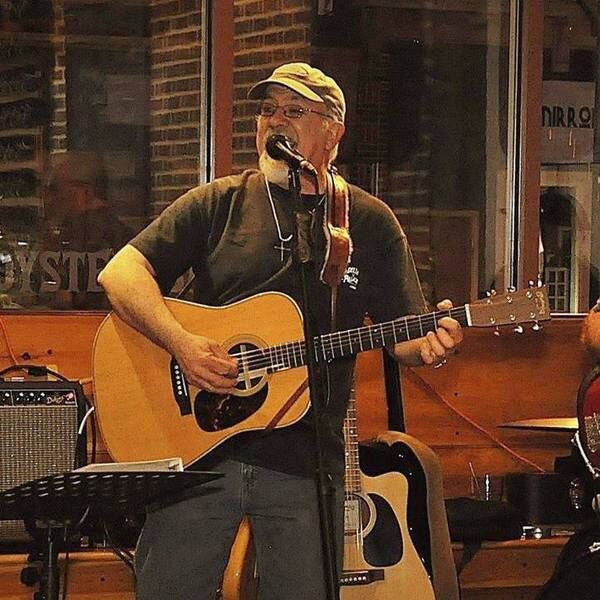
I want to click on brickwall, so click(x=189, y=113), click(x=255, y=39), click(x=420, y=225).